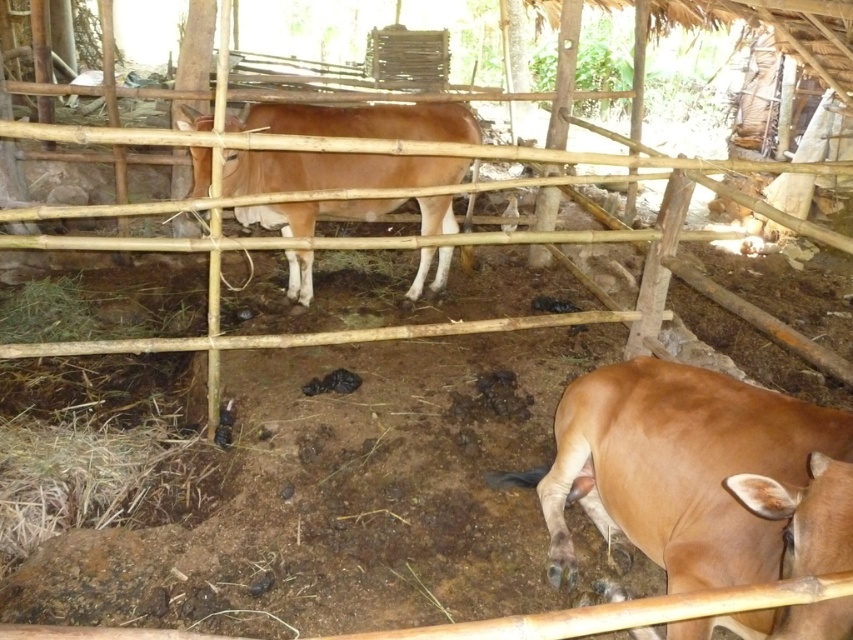
You are a farmer checking the enclosure for your cows. You notice two cows in the enclosure. Which cow is positioned lower in the image, the brown matte cow at lower right or the brown matte cow at center?

The brown matte cow at lower right is positioned lower in the image compared to the brown matte cow at center.

You are a farmer checking on your cows in the bamboo enclosure. You see the brown matte cow at lower right and the brown matte cow at center. Which cow is positioned more to the east if the bamboo fence is oriented north to south?

The brown matte cow at lower right is positioned more to the east because it is to the right of the brown matte cow at center, and since the bamboo fence is oriented north to south, the right side faces east.

You are a farmer checking the cows in the enclosure. You notice two cows, the brown matte cow at lower right and the brown matte cow at center. Which cow is shorter in height?

The brown matte cow at lower right is shorter than the brown matte cow at center.